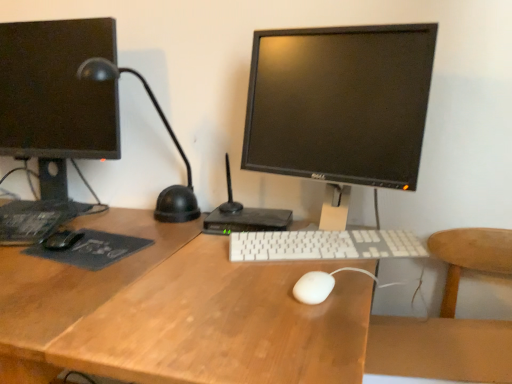
Find the location of a particular element. This screenshot has height=384, width=512. vacant area that is situated to the right of black matte mouse at left, marked as the 1th mouse in a top-to-bottom arrangement is located at coordinates (151, 239).